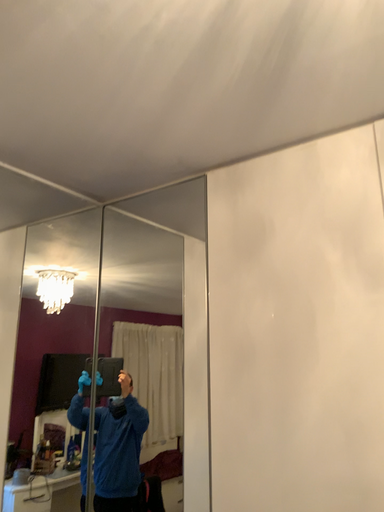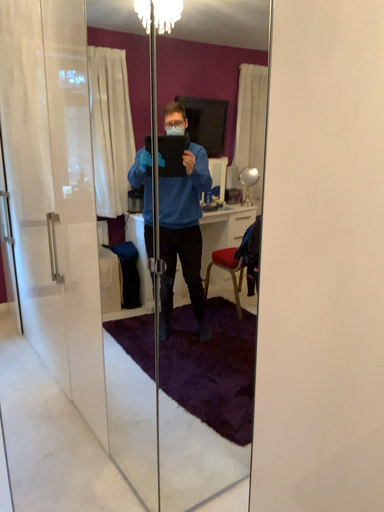
Question: Which way did the camera rotate in the video?

Choices:
 (A) rotated left
 (B) rotated right

Answer: (A)